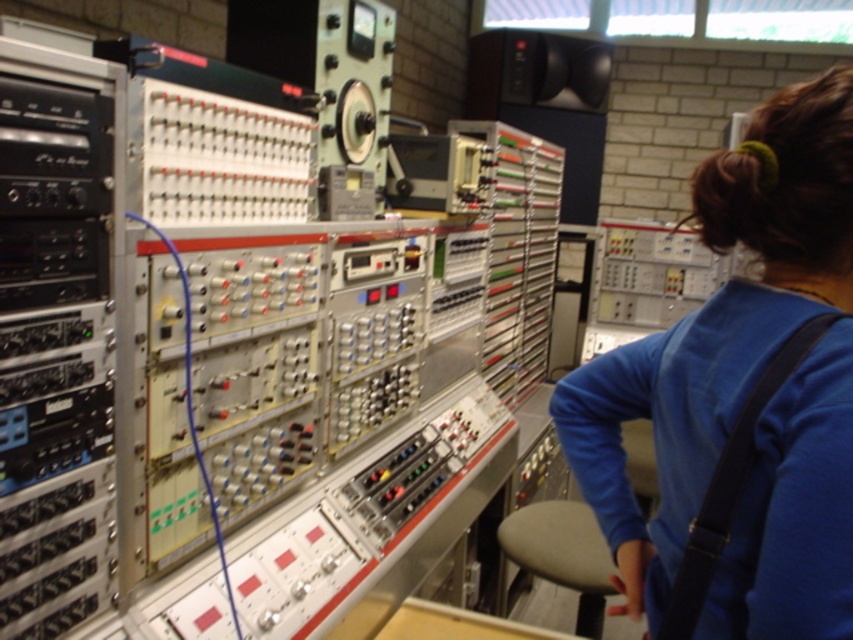
Question: Does blue fabric shirt at center appear under gray fabric stool at lower center?

Choices:
 (A) yes
 (B) no

Answer: (B)

Question: Among these points, which one is nearest to the camera?

Choices:
 (A) (584, 579)
 (B) (759, 289)

Answer: (B)

Question: Is blue fabric shirt at center positioned before gray fabric stool at lower center?

Choices:
 (A) yes
 (B) no

Answer: (A)

Question: Is blue fabric shirt at center to the right of gray fabric stool at lower center from the viewer's perspective?

Choices:
 (A) no
 (B) yes

Answer: (A)

Question: Which of the following is the closest to the observer?

Choices:
 (A) blue fabric shirt at center
 (B) gray fabric stool at lower center

Answer: (A)

Question: Among these objects, which one is nearest to the camera?

Choices:
 (A) blue fabric shirt at center
 (B) gray fabric stool at lower center

Answer: (A)